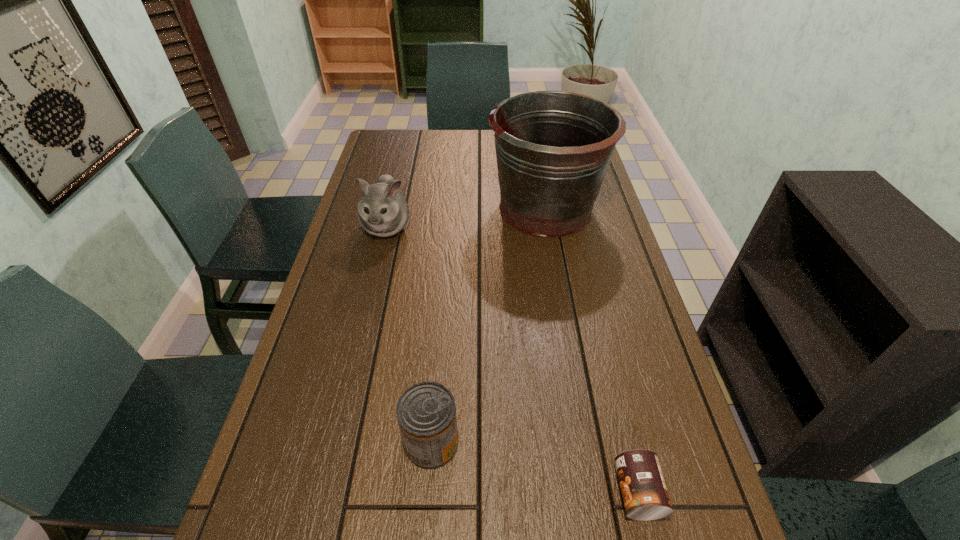
At what (x,y) coordinates should I click in order to perform the action: click on bucket. Please return your answer as a coordinate pair (x, y). The width and height of the screenshot is (960, 540). Looking at the image, I should click on pos(553,148).

Where is `the leftmost object`? The image size is (960, 540). the leftmost object is located at coordinates (383, 211).

This screenshot has width=960, height=540. Find the location of `the third shortest object`. the third shortest object is located at coordinates 383,211.

You are a GUI agent. You are given a task and a screenshot of the screen. Output one action in this format:
    pyautogui.click(x=<x>, y=<y>)
    Task: Click on the second object from left to right
    This screenshot has width=960, height=540.
    Given the screenshot: What is the action you would take?
    pyautogui.click(x=426, y=412)

Image resolution: width=960 pixels, height=540 pixels. I want to click on the left can, so click(426, 412).

In order to click on the right can in this screenshot , I will do `click(645, 496)`.

Locate an element on the screen. Image resolution: width=960 pixels, height=540 pixels. the shortest object is located at coordinates (645, 496).

What are the coordinates of `vacant space located on the front of the tallest object` in the screenshot? It's located at (559, 285).

At what (x,y) coordinates should I click in order to perform the action: click on free space located 0.120m on the face of the third shortest object. Please return your answer as a coordinate pair (x, y). Looking at the image, I should click on (374, 278).

Locate an element on the screen. free spot located on the back of the second object from left to right is located at coordinates (440, 346).